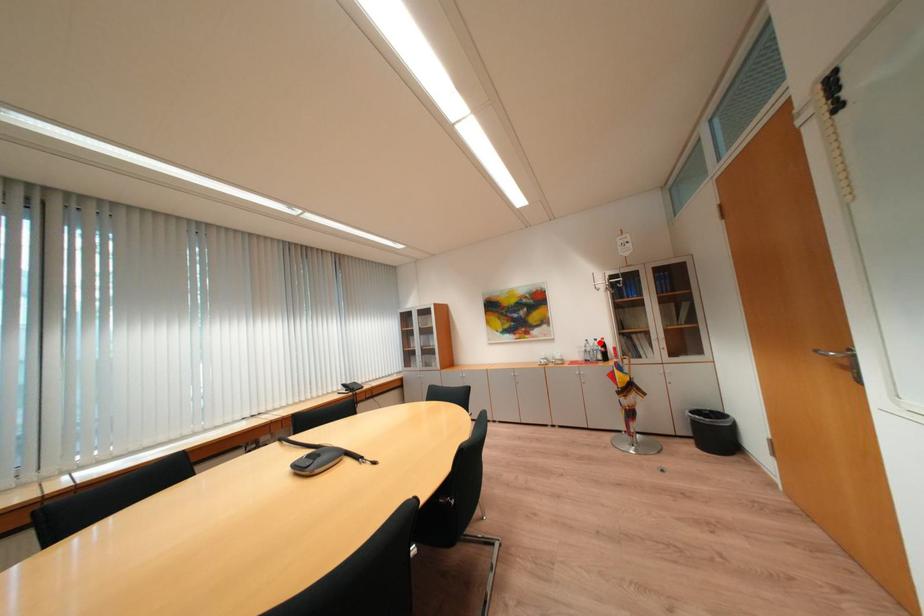
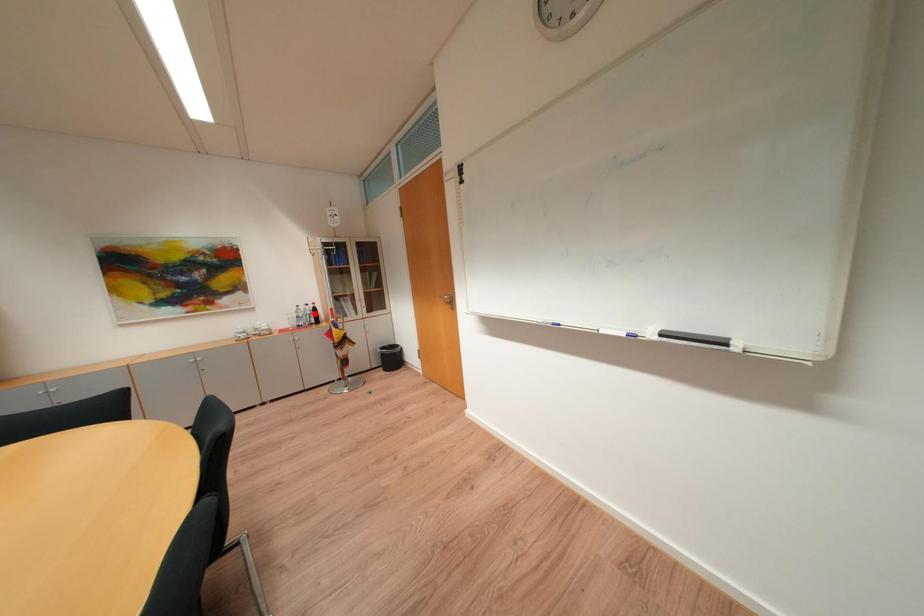
I am providing you with two images of the same scene from different viewpoints. A red point is marked on the first image and another point is marked on the second image. Does the point marked in image1 correspond to the same location as the one in image2?

No